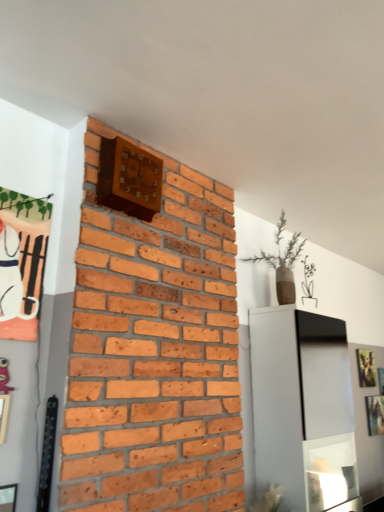
Question: Is gold metallic picture frame at upper right, the second picture frame in the left-to-right sequence, in front of metallic silver picture frame at upper right, which appears as the third picture frame when viewed from the left?

Choices:
 (A) no
 (B) yes

Answer: (A)

Question: Does gold metallic picture frame at upper right, the second picture frame in the left-to-right sequence, appear on the left side of metallic silver picture frame at upper right, which appears as the third picture frame when viewed from the left?

Choices:
 (A) no
 (B) yes

Answer: (B)

Question: Does gold metallic picture frame at upper right, the first picture frame from the back, appear on the right side of metallic silver picture frame at upper right, which appears as the third picture frame when viewed from the left?

Choices:
 (A) no
 (B) yes

Answer: (A)

Question: Does gold metallic picture frame at upper right, which is counted as the second picture frame, starting from the right, turn towards metallic silver picture frame at upper right, which appears as the third picture frame when viewed from the left?

Choices:
 (A) yes
 (B) no

Answer: (B)

Question: Considering the relative sizes of gold metallic picture frame at upper right, the first picture frame from the back, and metallic silver picture frame at upper right, which ranks as the 2th picture frame in front-to-back order, in the image provided, is gold metallic picture frame at upper right, the first picture frame from the back, bigger than metallic silver picture frame at upper right, which ranks as the 2th picture frame in front-to-back order,?

Choices:
 (A) no
 (B) yes

Answer: (B)

Question: Is point (374, 408) positioned closer to the camera than point (264, 495)?

Choices:
 (A) closer
 (B) farther

Answer: (B)

Question: Relative to green leafy plant at lower center, is metallic silver picture frame at upper right, the third picture frame when ordered from top to bottom, in front or behind?

Choices:
 (A) behind
 (B) front

Answer: (A)

Question: In the image, is metallic silver picture frame at upper right, which is the first picture frame in bottom-to-top order, on the left side or the right side of green leafy plant at lower center?

Choices:
 (A) right
 (B) left

Answer: (A)

Question: Is metallic silver picture frame at upper right, the third picture frame when ordered from top to bottom, taller or shorter than green leafy plant at lower center?

Choices:
 (A) tall
 (B) short

Answer: (A)

Question: Does point (380, 406) appear closer or farther from the camera than point (372, 362)?

Choices:
 (A) closer
 (B) farther

Answer: (A)

Question: Considering the positions of metallic silver picture frame at upper right, the 1th picture frame from the right, and gold metallic picture frame at upper right, which is counted as the second picture frame, starting from the right, in the image, is metallic silver picture frame at upper right, the 1th picture frame from the right, taller or shorter than gold metallic picture frame at upper right, which is counted as the second picture frame, starting from the right,?

Choices:
 (A) tall
 (B) short

Answer: (B)

Question: From a real-world perspective, is metallic silver picture frame at upper right, which ranks as the 2th picture frame in front-to-back order, physically located above or below gold metallic picture frame at upper right, arranged as the 2th picture frame when ordered from the bottom?

Choices:
 (A) below
 (B) above

Answer: (A)

Question: Is metallic silver picture frame at upper right, which is the first picture frame in bottom-to-top order, wider or thinner than gold metallic picture frame at upper right, the second picture frame in the left-to-right sequence?

Choices:
 (A) wide
 (B) thin

Answer: (B)

Question: From a real-world perspective, is green leafy plant at lower center physically located above or below metallic silver picture frame at upper right, which ranks as the 2th picture frame in front-to-back order?

Choices:
 (A) above
 (B) below

Answer: (B)

Question: Is green leafy plant at lower center taller or shorter than metallic silver picture frame at upper right, the 1th picture frame from the right?

Choices:
 (A) short
 (B) tall

Answer: (A)